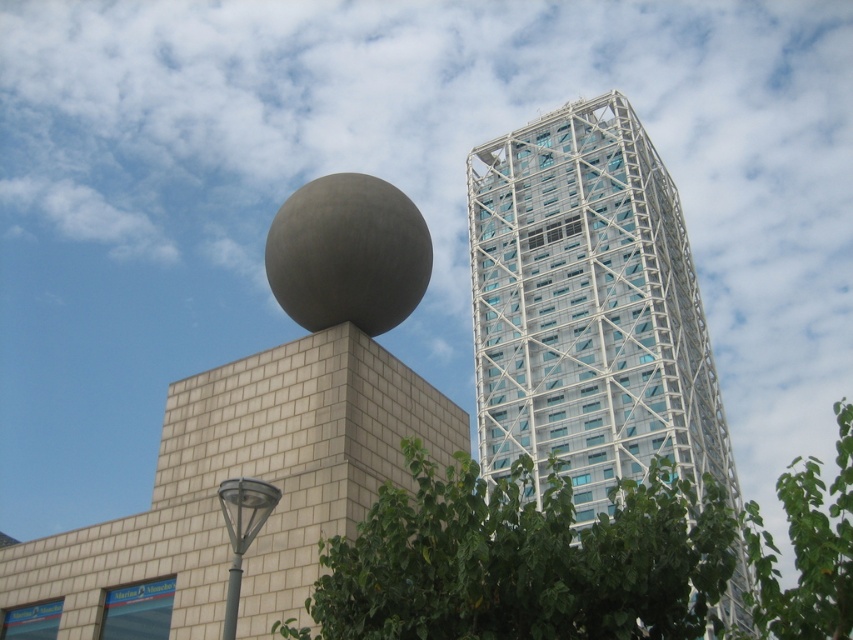
You are standing at the camera position and want to take a photo of the white glass building at upper center. If your camera has a maximum focus range of 150 feet, will it be able to capture the building clearly?

The white glass building at upper center is 156.00 feet away from the camera, which exceeds the maximum focus range of 150 feet. Therefore, the camera will not be able to capture the building clearly.

You are standing at the point marked by the coordinates point [579,560] in the image. Looking around, you see a green leafy tree at center. Which direction should you face to see the rectangular building with the metallic sphere on the left side?

You should face west because the rectangular building with the metallic sphere is located to the west of the green leafy tree at center marked by point [579,560].

You are a drone operator trying to fly a drone from the metallic gray streetlight at lower left to the white glass building at upper center. Based on the scene, can you determine if the drone has a clear vertical path upwards without obstacles?

The white glass building at upper center is above the metallic gray streetlight at lower left, so the drone can fly upwards from the metallic gray streetlight at lower left to the white glass building at upper center without obstacles in the vertical path.